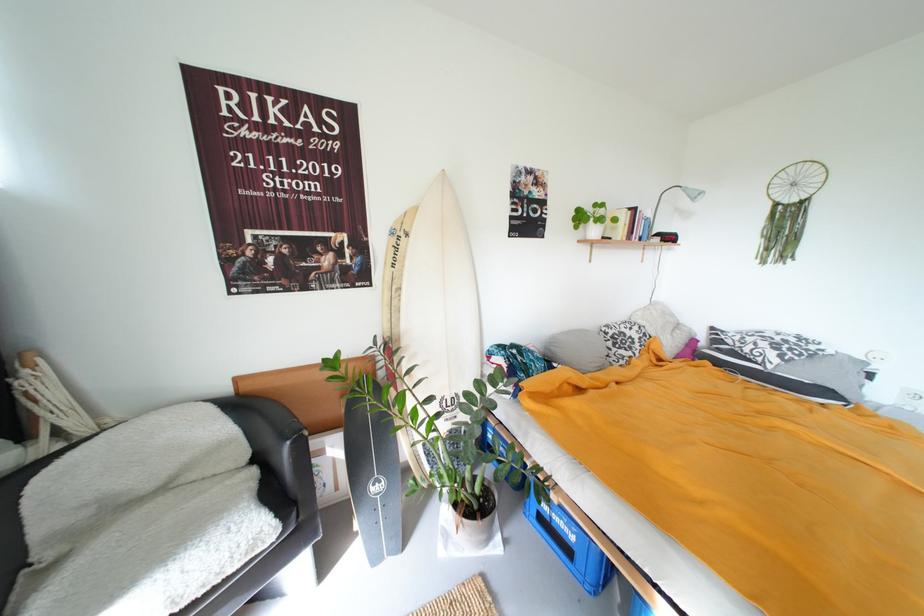
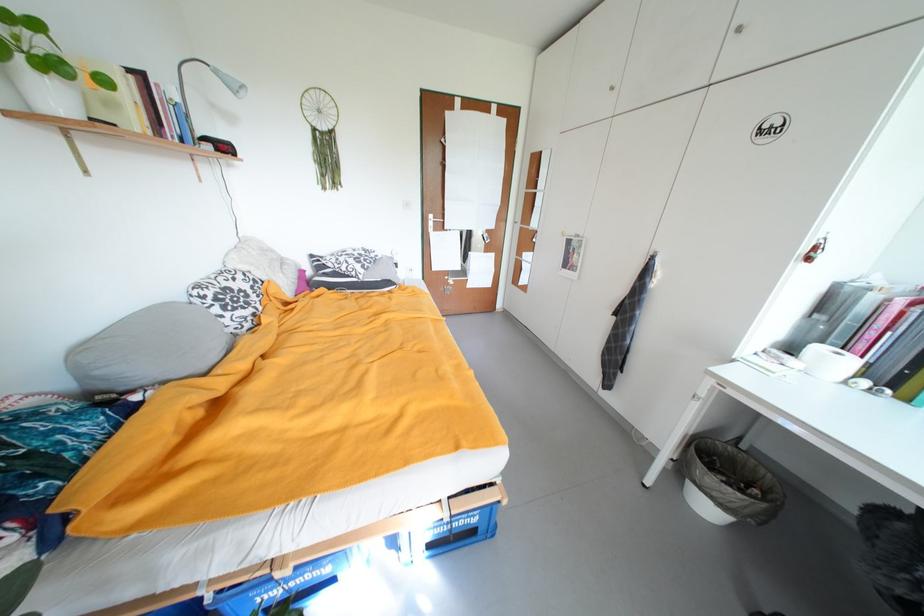
The point at (x=560, y=350) is marked in the first image. Where is the corresponding point in the second image?

(105, 374)